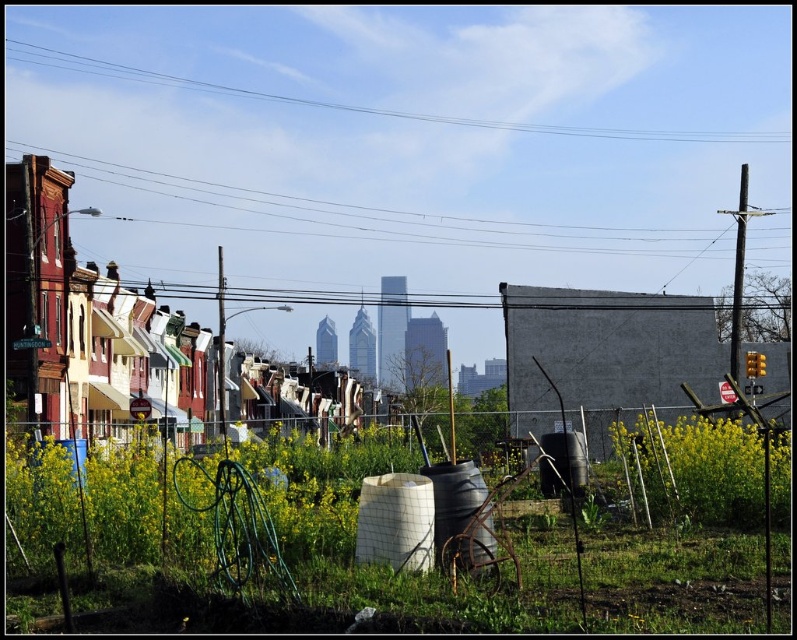
Question: Which point is closer to the camera?

Choices:
 (A) clear blue wire at upper center
 (B) green grass at lower center

Answer: (B)

Question: Which point appears closest to the camera in this image?

Choices:
 (A) (130, 67)
 (B) (34, 557)

Answer: (B)

Question: In this image, where is green grass at lower center located relative to clear blue wire at upper center?

Choices:
 (A) left
 (B) right

Answer: (B)

Question: Is green grass at lower center to the left of clear blue wire at upper center from the viewer's perspective?

Choices:
 (A) no
 (B) yes

Answer: (A)

Question: Which of the following is the closest to the observer?

Choices:
 (A) clear blue wire at upper center
 (B) green grass at lower center

Answer: (B)

Question: Can you confirm if green grass at lower center is positioned to the right of clear blue wire at upper center?

Choices:
 (A) no
 (B) yes

Answer: (B)